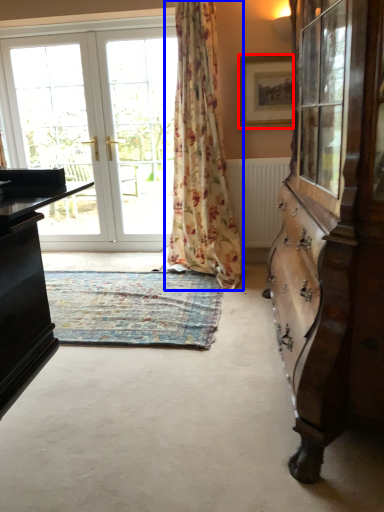
Question: Among these objects, which one is farthest to the camera, picture frame (highlighted by a red box) or curtain (highlighted by a blue box)?

Choices:
 (A) picture frame
 (B) curtain

Answer: (A)